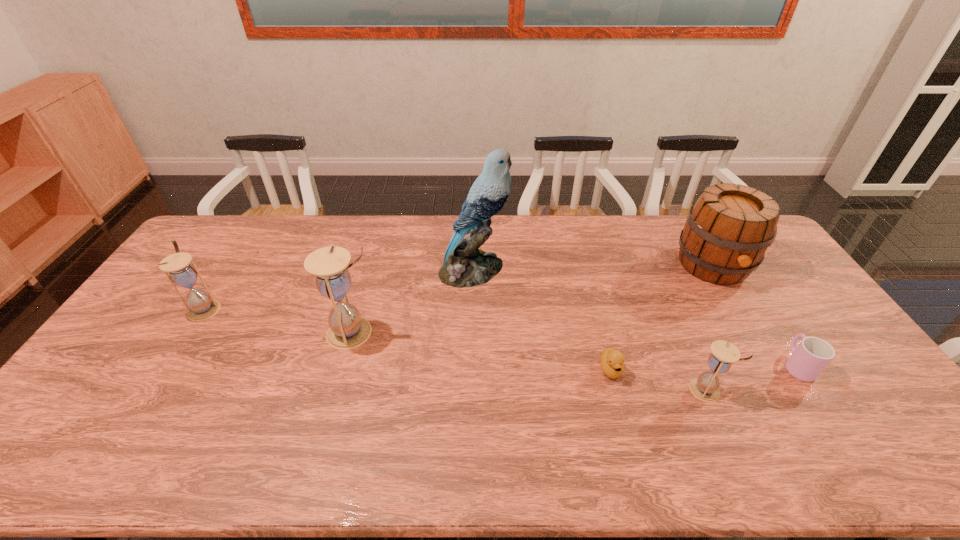
Image resolution: width=960 pixels, height=540 pixels. What are the coordinates of `vacant point located between the tallest object and the third shortest object` in the screenshot? It's located at pyautogui.click(x=589, y=329).

The width and height of the screenshot is (960, 540). Find the location of `free point between the cup and the tallest object`. free point between the cup and the tallest object is located at coordinates (636, 318).

Where is `vacant point located between the tallest hourglass and the parakeet`? This screenshot has height=540, width=960. vacant point located between the tallest hourglass and the parakeet is located at coordinates (413, 301).

At what (x,y) coordinates should I click in order to perform the action: click on the third closest object to the third object from right to left. Please return your answer as a coordinate pair (x, y). This screenshot has height=540, width=960. Looking at the image, I should click on (729, 228).

Locate which object ranks sixth in proximity to the cider. Please provide its 2D coordinates. Your answer should be formatted as a tuple, i.e. [(x, y)], where the tuple contains the x and y coordinates of a point satisfying the conditions above.

[(201, 306)]

Locate which hourglass is the second closest to the tallest hourglass. Please provide its 2D coordinates. Your answer should be formatted as a tuple, i.e. [(x, y)], where the tuple contains the x and y coordinates of a point satisfying the conditions above.

[(705, 387)]

You are a GUI agent. You are given a task and a screenshot of the screen. Output one action in this format:
    pyautogui.click(x=<x>, y=<y>)
    Task: Click on the hourglass that stands as the second closest to the duckling
    The image size is (960, 540).
    Given the screenshot: What is the action you would take?
    pyautogui.click(x=347, y=330)